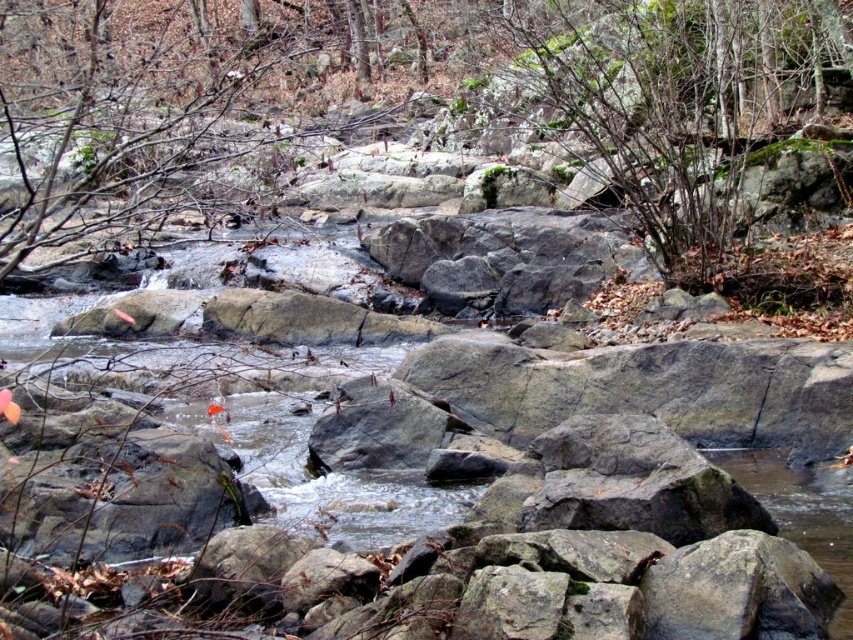
Does point (627, 124) lie behind point (711, 141)?

No, it is not.

Can you confirm if green mossy rock at center is positioned to the right of green mossy shrub at upper center?

No, green mossy rock at center is not to the right of green mossy shrub at upper center.

Where is `green mossy rock at center`? This screenshot has width=853, height=640. green mossy rock at center is located at coordinates (660, 92).

At what (x,y) coordinates should I click in order to perform the action: click on green mossy rock at center. Please return your answer as a coordinate pair (x, y). Looking at the image, I should click on (660, 92).